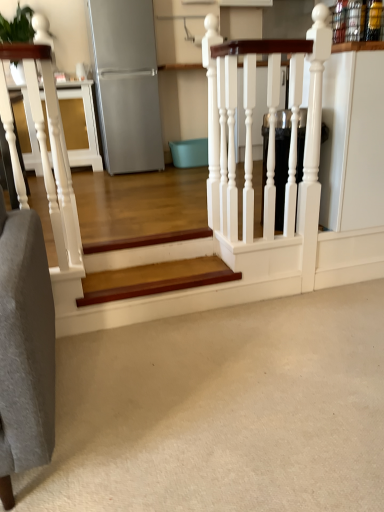
Question: Is satin silver refrigerator at upper left facing away from white carpet at lower center?

Choices:
 (A) yes
 (B) no

Answer: (B)

Question: Is the surface of satin silver refrigerator at upper left in direct contact with white carpet at lower center?

Choices:
 (A) no
 (B) yes

Answer: (A)

Question: From a real-world perspective, is satin silver refrigerator at upper left beneath white carpet at lower center?

Choices:
 (A) yes
 (B) no

Answer: (B)

Question: Is satin silver refrigerator at upper left further to the viewer compared to white carpet at lower center?

Choices:
 (A) yes
 (B) no

Answer: (A)

Question: Is satin silver refrigerator at upper left positioned in front of white carpet at lower center?

Choices:
 (A) no
 (B) yes

Answer: (A)

Question: Do you think white carpet at lower center is within satin silver refrigerator at upper left, or outside of it?

Choices:
 (A) outside
 (B) inside

Answer: (A)

Question: Looking at their shapes, would you say white carpet at lower center is wider or thinner than satin silver refrigerator at upper left?

Choices:
 (A) wide
 (B) thin

Answer: (A)

Question: From a real-world perspective, is white carpet at lower center above or below satin silver refrigerator at upper left?

Choices:
 (A) below
 (B) above

Answer: (A)

Question: Considering the positions of point (256, 333) and point (130, 24), is point (256, 333) closer or farther from the camera than point (130, 24)?

Choices:
 (A) closer
 (B) farther

Answer: (A)

Question: Is wooden stair at center situated inside white carpet at lower center or outside?

Choices:
 (A) inside
 (B) outside

Answer: (B)

Question: From the image's perspective, is wooden stair at center located above or below white carpet at lower center?

Choices:
 (A) below
 (B) above

Answer: (B)

Question: Does point (168, 288) appear closer or farther from the camera than point (201, 330)?

Choices:
 (A) farther
 (B) closer

Answer: (A)

Question: In terms of size, does wooden stair at center appear bigger or smaller than white carpet at lower center?

Choices:
 (A) small
 (B) big

Answer: (A)

Question: Would you say satin silver refrigerator at upper left is to the left or to the right of white carpet at lower center in the picture?

Choices:
 (A) right
 (B) left

Answer: (B)

Question: Relative to white carpet at lower center, is satin silver refrigerator at upper left in front or behind?

Choices:
 (A) front
 (B) behind

Answer: (B)